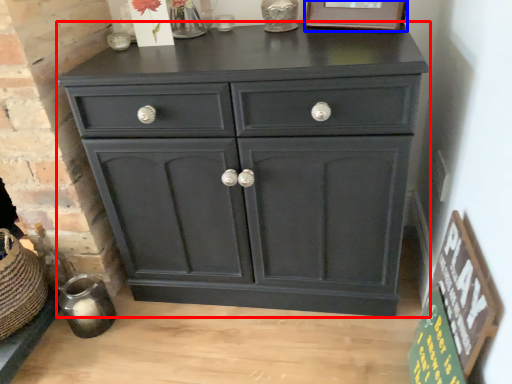
Question: Which point is closer to the camera, chest of drawers (highlighted by a red box) or picture frame (highlighted by a blue box)?

Choices:
 (A) chest of drawers
 (B) picture frame

Answer: (A)